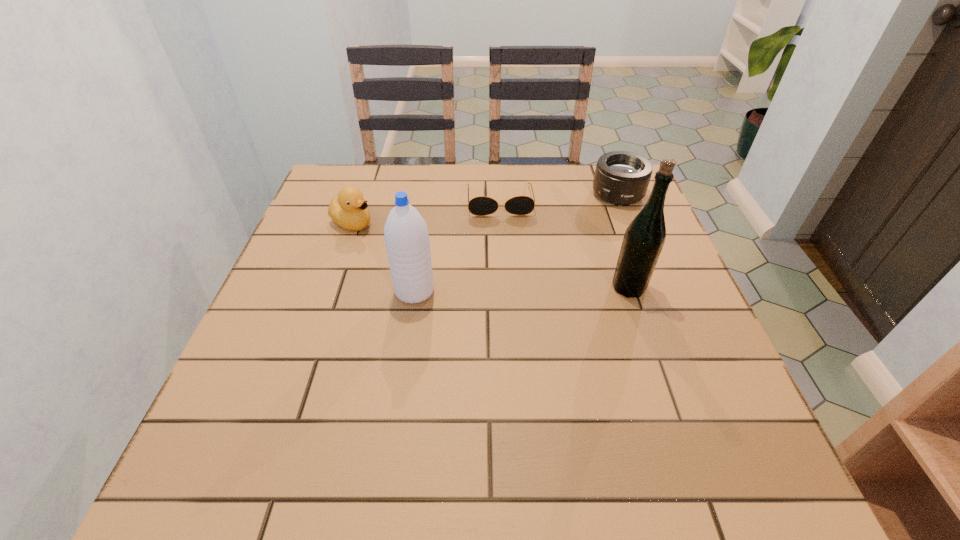
The height and width of the screenshot is (540, 960). I want to click on free spot located on the front-facing side of the shortest object, so click(x=507, y=274).

Image resolution: width=960 pixels, height=540 pixels. In order to click on vacant region located 0.280m on the front-facing side of the shortest object in this screenshot , I will do `click(509, 292)`.

Where is `vacant space located 0.400m on the side of the fourth tallest object with brand markings and control switches`? The image size is (960, 540). vacant space located 0.400m on the side of the fourth tallest object with brand markings and control switches is located at coordinates click(534, 291).

Where is `free spot located 0.050m on the side of the fourth tallest object with brand markings and control switches`? The image size is (960, 540). free spot located 0.050m on the side of the fourth tallest object with brand markings and control switches is located at coordinates (600, 215).

Find the location of a particular element. Image resolution: width=960 pixels, height=540 pixels. vacant space located 0.110m on the side of the fourth tallest object with brand markings and control switches is located at coordinates (590, 226).

Find the location of `free space located on the face of the duckling`. free space located on the face of the duckling is located at coordinates (384, 236).

This screenshot has width=960, height=540. I want to click on vacant space located 0.210m on the face of the duckling, so click(x=434, y=259).

The height and width of the screenshot is (540, 960). I want to click on free space located on the face of the duckling, so click(x=415, y=250).

Find the location of a particular element. The width and height of the screenshot is (960, 540). sunglasses that is at the far edge is located at coordinates (482, 205).

The image size is (960, 540). In order to click on telephoto lens that is at the far edge in this screenshot , I will do `click(621, 178)`.